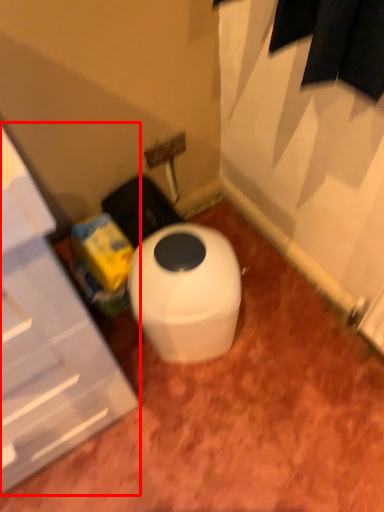
Question: From the image, what is the correct spatial relationship of cabinetry (annotated by the red box) in relation to toilet?

Choices:
 (A) left
 (B) right

Answer: (A)